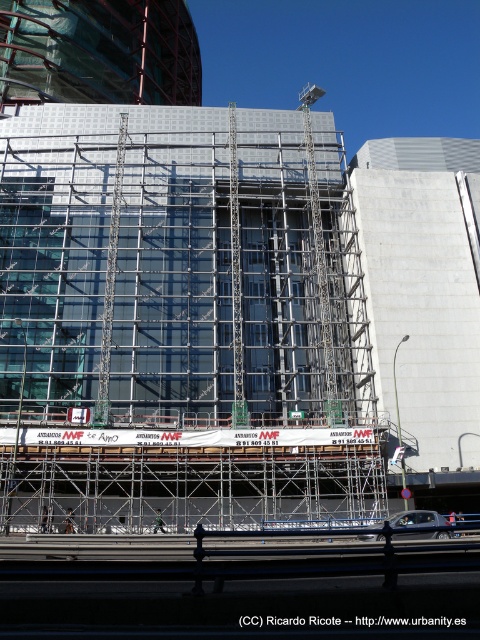
Between metal scaffolding at center and metallic helmet at center, which one has less height?

With less height is metallic helmet at center.

The image size is (480, 640). I want to click on metal scaffolding at center, so click(x=181, y=321).

This screenshot has width=480, height=640. I want to click on metal scaffolding at center, so click(181, 321).